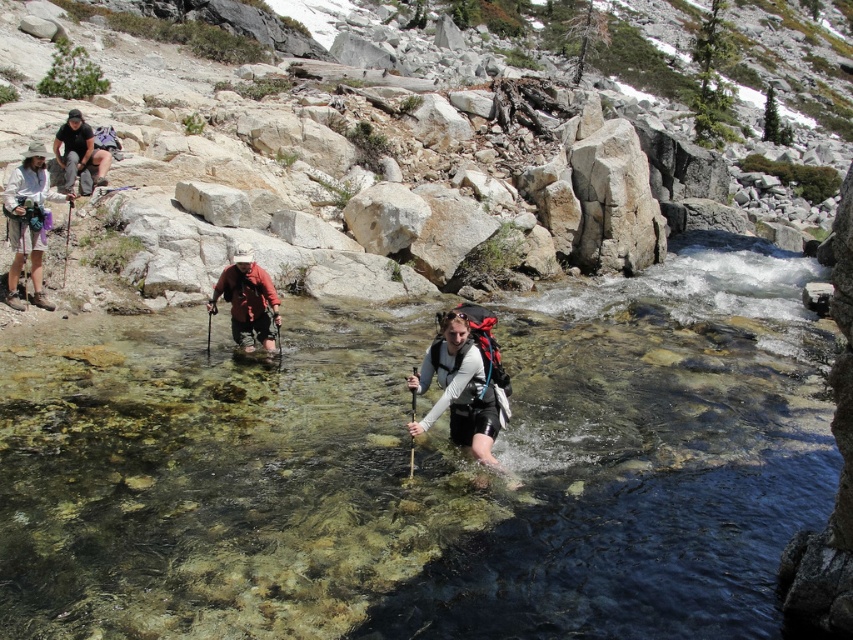
Question: Is matte black backpack at center to the left of matte black backpack at upper left from the viewer's perspective?

Choices:
 (A) no
 (B) yes

Answer: (A)

Question: Based on their relative distances, which object is nearer to the matte black backpack at upper left?

Choices:
 (A) white rock at upper center
 (B) matte red jacket at center
 (C) matte black backpack at center

Answer: (B)

Question: Can you confirm if matte red jacket at center is positioned above matte black backpack at upper left?

Choices:
 (A) yes
 (B) no

Answer: (B)

Question: Among these points, which one is nearest to the camera?

Choices:
 (A) pyautogui.click(x=15, y=189)
 (B) pyautogui.click(x=234, y=291)
 (C) pyautogui.click(x=474, y=342)
 (D) pyautogui.click(x=70, y=129)

Answer: (C)

Question: Among these points, which one is farthest from the camera?

Choices:
 (A) (x=169, y=348)
 (B) (x=422, y=390)
 (C) (x=798, y=237)

Answer: (C)

Question: Is white rock at upper center to the left of matte black backpack at center from the viewer's perspective?

Choices:
 (A) no
 (B) yes

Answer: (A)